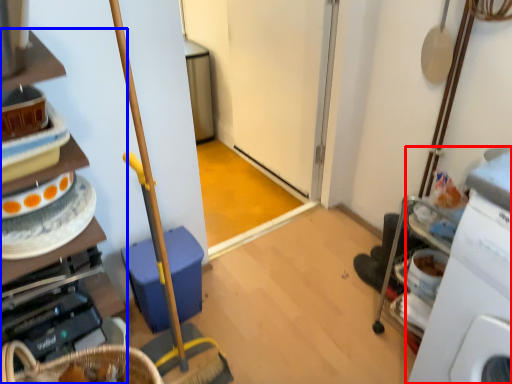
Question: Which object appears closest to the camera in this image, machine (highlighted by a red box) or cabinetry (highlighted by a blue box)?

Choices:
 (A) machine
 (B) cabinetry

Answer: (A)